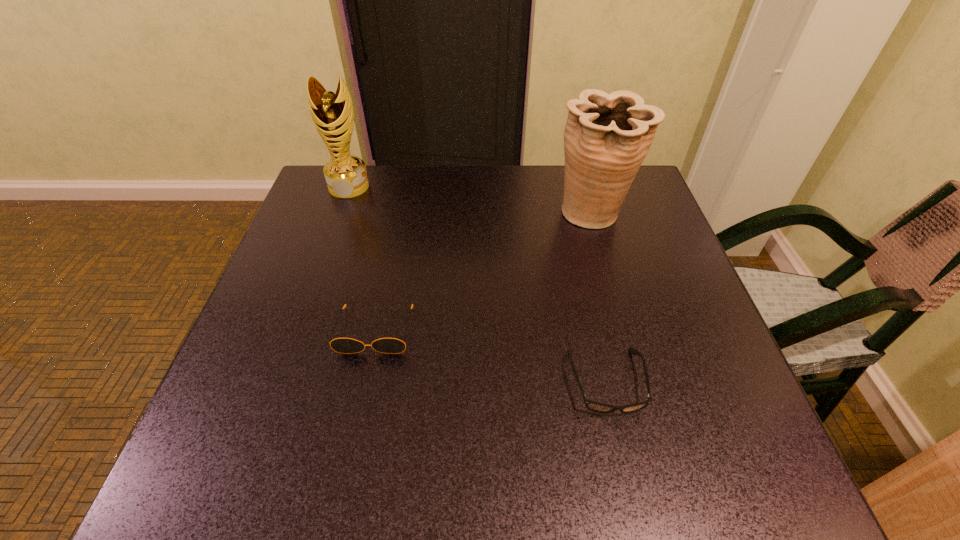
At what (x,y) coordinates should I click in order to perform the action: click on free spot at the far left corner of the desktop. Please return your answer as a coordinate pair (x, y). Looking at the image, I should click on (341, 213).

At what (x,y) coordinates should I click in order to perform the action: click on unoccupied position between the second object from left to right and the leftmost object. Please return your answer as a coordinate pair (x, y). The width and height of the screenshot is (960, 540). Looking at the image, I should click on (362, 258).

What are the coordinates of `unoccupied position between the urn and the sunglasses` in the screenshot? It's located at (484, 272).

Where is `free space between the urn and the spectacles`? free space between the urn and the spectacles is located at coordinates (599, 298).

Identify the location of free area in between the leftmost object and the sunglasses. pyautogui.click(x=362, y=258).

Find the location of `vacant space that is in between the leftmost object and the shortest object`. vacant space that is in between the leftmost object and the shortest object is located at coordinates (478, 284).

Locate an element on the screen. This screenshot has height=540, width=960. empty space between the leftmost object and the urn is located at coordinates (470, 200).

Find the location of a particular element. Image resolution: width=960 pixels, height=540 pixels. vacant area that lies between the award and the urn is located at coordinates (470, 200).

Locate an element on the screen. Image resolution: width=960 pixels, height=540 pixels. free space between the sunglasses and the urn is located at coordinates (484, 272).

This screenshot has width=960, height=540. I want to click on empty space between the leftmost object and the second shortest object, so click(x=362, y=258).